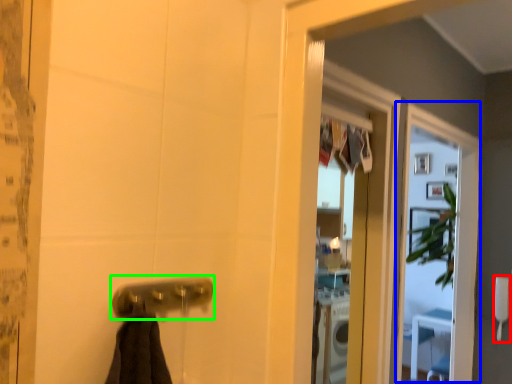
Question: Estimate the real-world distances between objects in this image. Which object is farther from towel bar (highlighted by a red box), screen door (highlighted by a blue box) or door handle (highlighted by a green box)?

Choices:
 (A) screen door
 (B) door handle

Answer: (B)